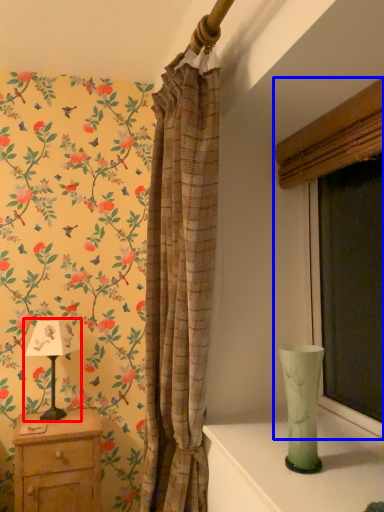
Question: Which of the following is the closest to the observer, table lamp (highlighted by a red box) or window (highlighted by a blue box)?

Choices:
 (A) table lamp
 (B) window

Answer: (B)